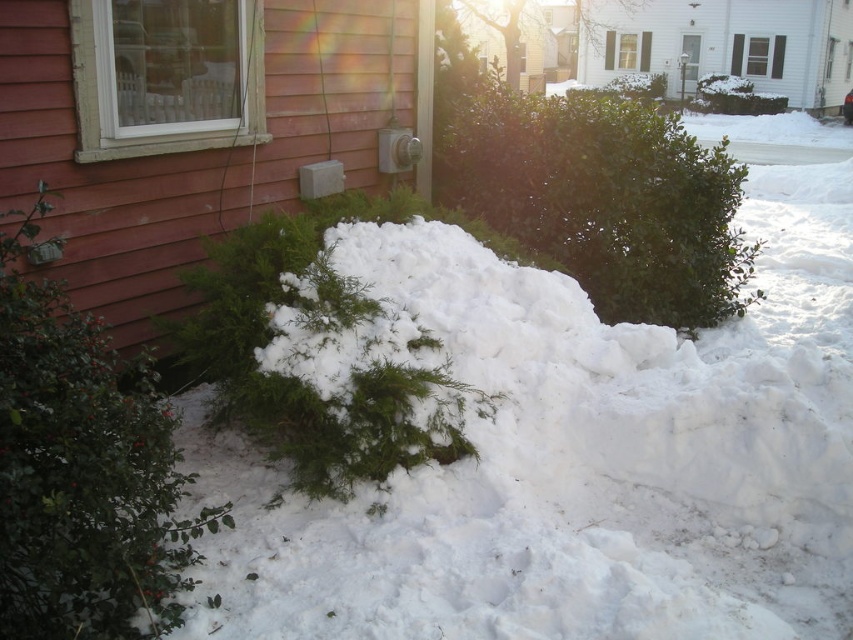
You are standing in the snowy residential scene and want to place a small decoration on the green leafy bush at lower left. Based on its position, where exactly should you look to find the bush?

The green leafy bush at lower left is located at point [82,468], so you should look towards those coordinates to find it.